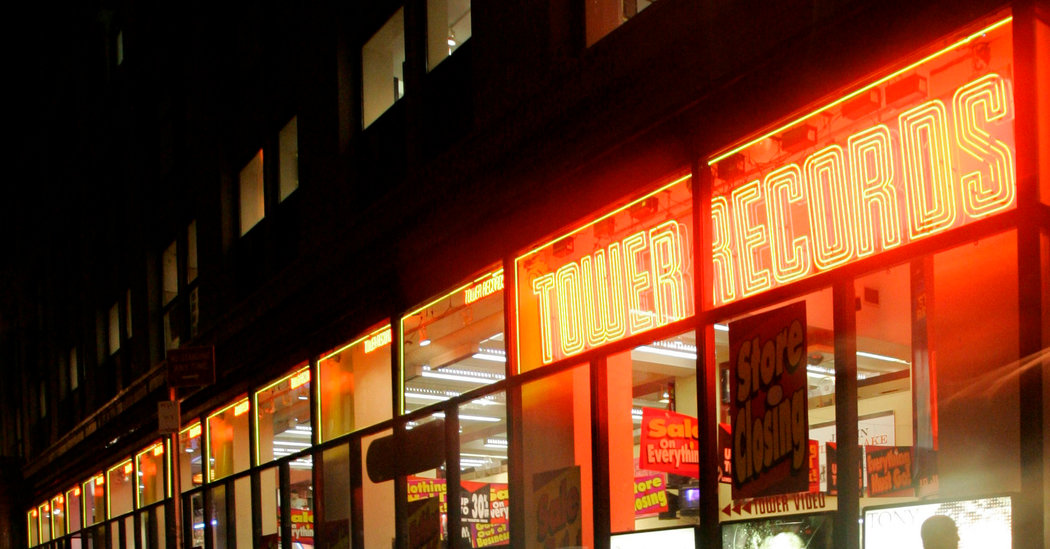
You are a GUI agent. You are given a task and a screenshot of the screen. Output one action in this format:
    pyautogui.click(x=<x>, y=<y>)
    Task: Click on the black 30% off sign inside store
    This screenshot has width=1050, height=549.
    Given the screenshot: What is the action you would take?
    pyautogui.click(x=475, y=504)